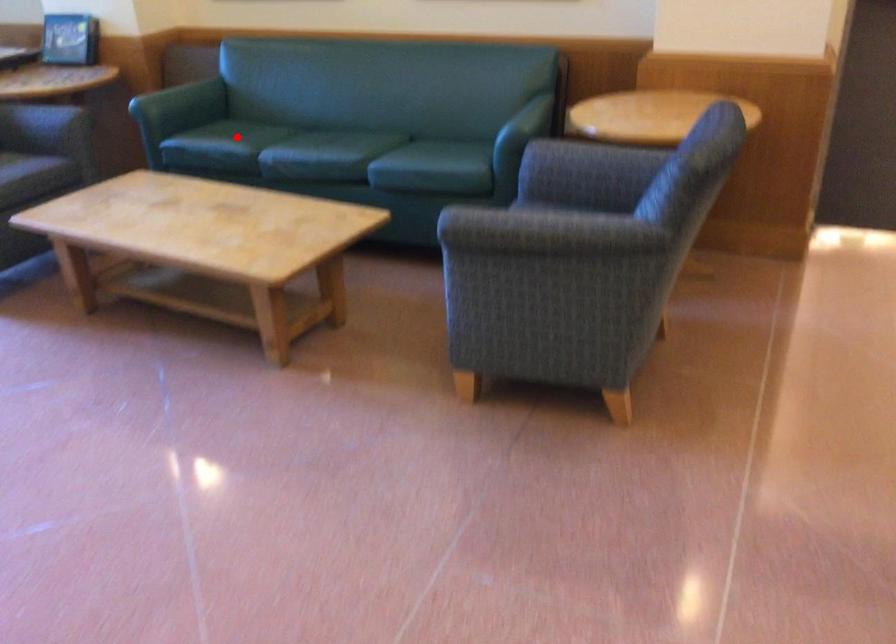
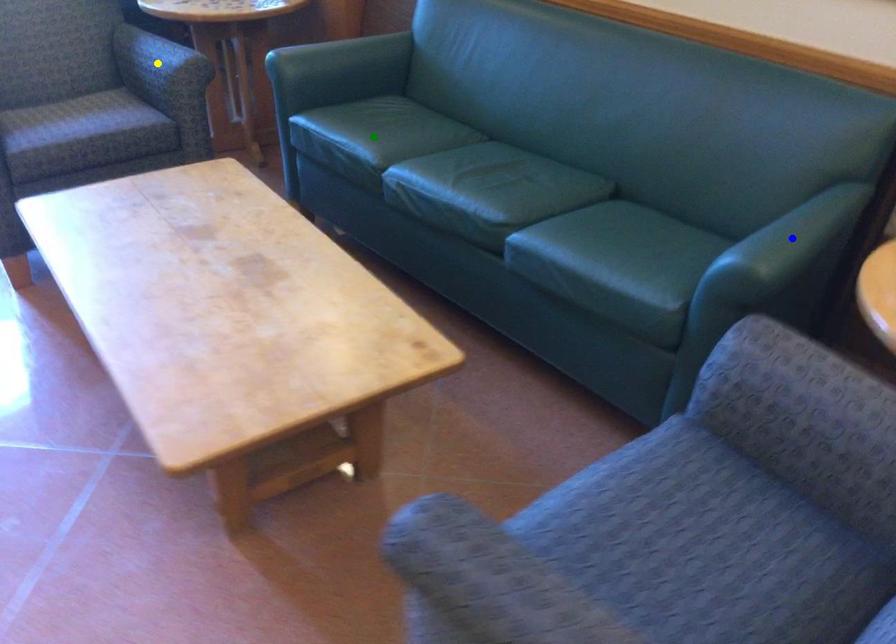
Question: I am providing you with two images of the same scene from different viewpoints. A red point is marked on the first image. You are given multiple points on the second image. Can you choose the point in image 2 that corresponds to the point in image 1?

Choices:
 (A) green point
 (B) yellow point
 (C) blue point

Answer: (A)